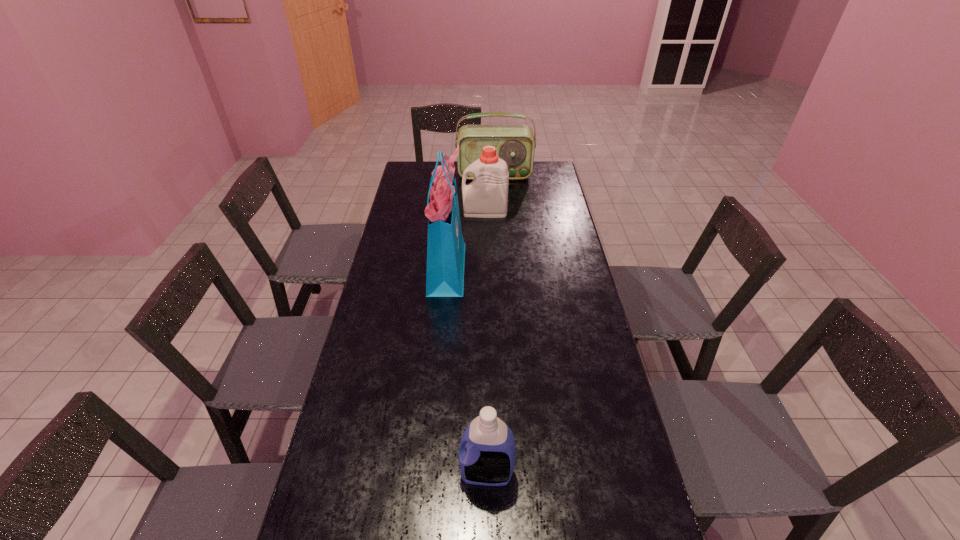
The image size is (960, 540). What are the coordinates of `shopping bag` in the screenshot? It's located at (445, 249).

At what (x,y) coordinates should I click in order to perform the action: click on the second nearest object. Please return your answer as a coordinate pair (x, y). Looking at the image, I should click on (445, 249).

This screenshot has width=960, height=540. Find the location of `the farthest object`. the farthest object is located at coordinates (515, 144).

The image size is (960, 540). I want to click on the third nearest object, so click(486, 196).

Locate an element on the screen. the nearer detergent is located at coordinates click(487, 452).

I want to click on free space located on the back of the tallest object, so click(454, 191).

Where is `vacant space positioned on the front panel of the radio receiver`? vacant space positioned on the front panel of the radio receiver is located at coordinates (495, 188).

Locate an element on the screen. Image resolution: width=960 pixels, height=540 pixels. vacant space situated on the handle side of the farther detergent is located at coordinates (428, 212).

Where is `free spot located 0.190m on the handle side of the farther detergent`? The height and width of the screenshot is (540, 960). free spot located 0.190m on the handle side of the farther detergent is located at coordinates (419, 212).

Where is `vacant space located on the handle side of the farther detergent`? The width and height of the screenshot is (960, 540). vacant space located on the handle side of the farther detergent is located at coordinates (397, 212).